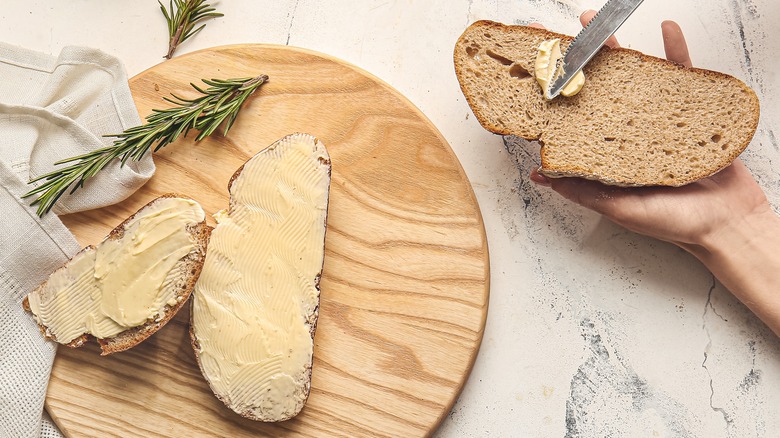
Find the location of a particular element. counter is located at coordinates (122, 27), (413, 41), (639, 313), (734, 41).